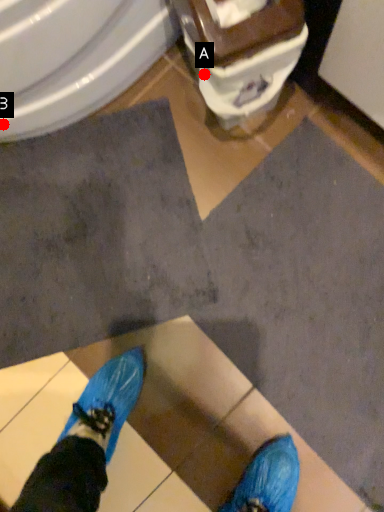
Question: Two points are circled on the image, labeled by A and B beside each circle. Among these points, which one is farthest from the camera?

Choices:
 (A) A is further
 (B) B is further

Answer: (B)